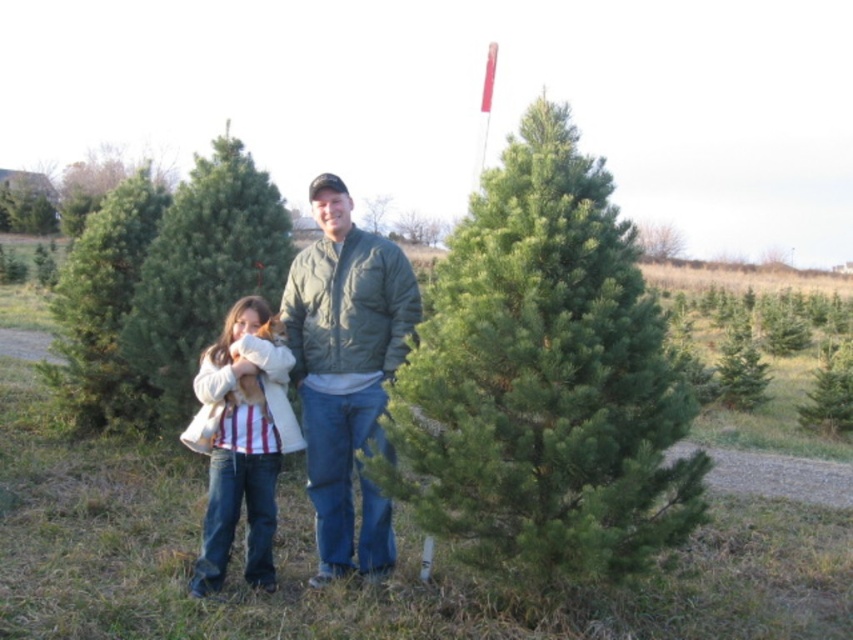
Which of these two, green matte jacket at center or green matte pine at left, stands taller?

green matte pine at left

Is point (350, 435) farther from viewer compared to point (51, 372)?

No, it is in front of (51, 372).

The image size is (853, 640). In order to click on green matte jacket at center in this screenshot , I will do `click(343, 355)`.

Does white fleece jacket at center have a greater height compared to green matte pine at left?

In fact, white fleece jacket at center may be shorter than green matte pine at left.

Is white fleece jacket at center shorter than green matte pine at left?

Yes.

Where is `white fleece jacket at center`? The height and width of the screenshot is (640, 853). white fleece jacket at center is located at coordinates (241, 440).

Locate an element on the screen. white fleece jacket at center is located at coordinates (241, 440).

Can you confirm if green needle-like at center is positioned to the right of green matte jacket at center?

Indeed, green needle-like at center is positioned on the right side of green matte jacket at center.

In the scene shown: Between green needle-like at center and green matte jacket at center, which one has more height?

Standing taller between the two is green needle-like at center.

Does point (474, 252) lie behind point (387, 529)?

No, (474, 252) is in front of (387, 529).

The image size is (853, 640). I want to click on green needle-like at center, so click(543, 380).